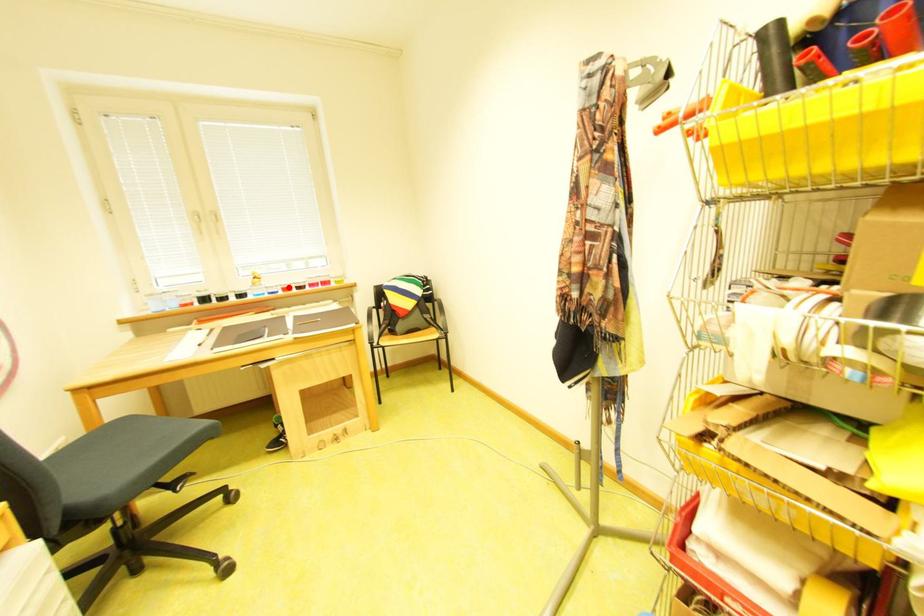
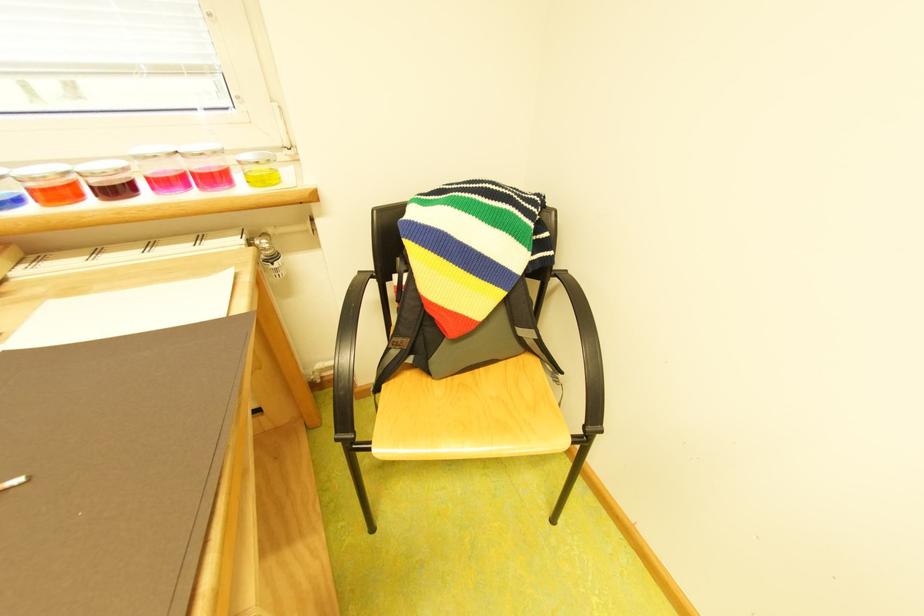
Where in the second image is the point corresponding to the highlighted location from the first image?

(11, 180)